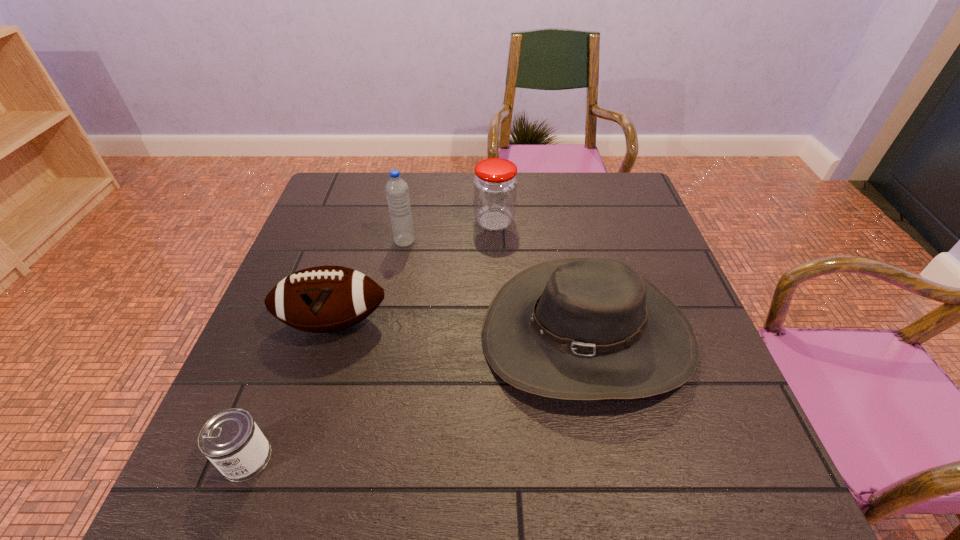
This screenshot has width=960, height=540. What are the coordinates of `vacant region located on the right of the football (American)` in the screenshot? It's located at (489, 322).

Identify the location of free location located 0.390m on the right of the nearest object. (491, 458).

Where is `object located at the far edge`? object located at the far edge is located at coordinates (495, 185).

Where is `object located in the near edge section of the desktop`? object located in the near edge section of the desktop is located at coordinates (231, 440).

Find the location of a particular element. football (American) located at the left edge is located at coordinates (323, 299).

This screenshot has height=540, width=960. What are the coordinates of `can situated at the left edge` in the screenshot? It's located at point(231,440).

Identify the location of object located at the right edge. (580, 329).

Image resolution: width=960 pixels, height=540 pixels. What are the coordinates of `object at the near left corner` in the screenshot? It's located at (231, 440).

The height and width of the screenshot is (540, 960). I want to click on free space at the far edge, so click(x=552, y=181).

In the image, there is a desktop. At what (x,y) coordinates should I click in order to perform the action: click on vacant region at the left edge. Please return your answer as a coordinate pair (x, y). The width and height of the screenshot is (960, 540). Looking at the image, I should click on (276, 319).